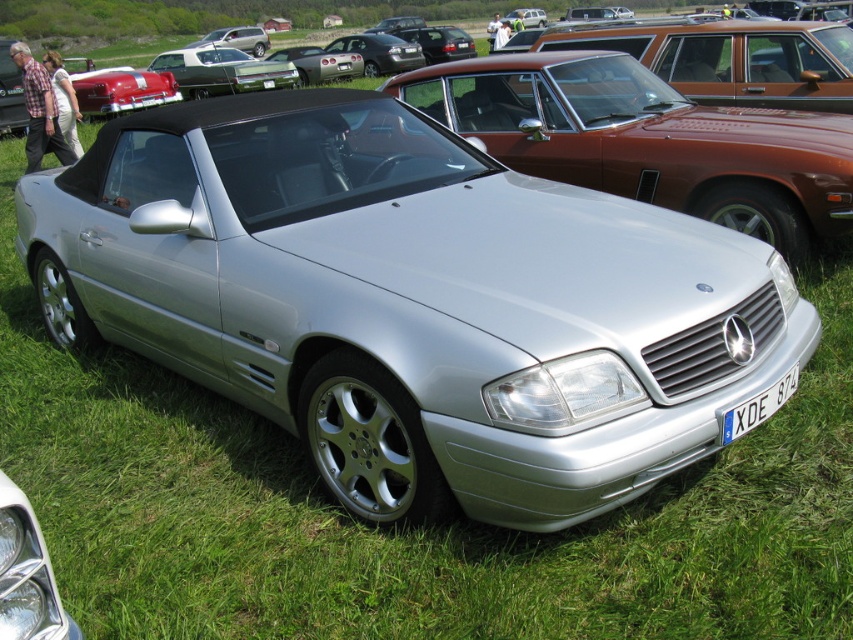
Between point (631, 92) and point (183, 52), which one is positioned in front?

Point (631, 92) is more forward.

Can you confirm if silver metallic convertible at center is bigger than shiny silver convertible at center?

Incorrect, silver metallic convertible at center is not larger than shiny silver convertible at center.

Between point (643, 156) and point (210, 90), which one is positioned in front?

Point (643, 156)

Where is `silver metallic convertible at center`? The height and width of the screenshot is (640, 853). silver metallic convertible at center is located at coordinates (648, 140).

Is silver metallic convertible at center above matte brown station wagon at upper center?

Actually, silver metallic convertible at center is below matte brown station wagon at upper center.

Is point (473, 77) more distant than point (709, 68)?

No, (473, 77) is closer to viewer.

You are a GUI agent. You are given a task and a screenshot of the screen. Output one action in this format:
    pyautogui.click(x=<x>, y=<y>)
    Task: Click on the silver metallic convertible at center
    The width and height of the screenshot is (853, 640).
    Given the screenshot: What is the action you would take?
    pyautogui.click(x=648, y=140)

In the scene shown: Between matte brown station wagon at upper center and satin silver metallic car at upper center, which one is positioned higher?

satin silver metallic car at upper center is above.

Does matte brown station wagon at upper center have a smaller size compared to satin silver metallic car at upper center?

Correct, matte brown station wagon at upper center occupies less space than satin silver metallic car at upper center.

Who is more distant from viewer, (809, 104) or (248, 32)?

The point (248, 32) is behind.

Locate an element on the screen. matte brown station wagon at upper center is located at coordinates (732, 60).